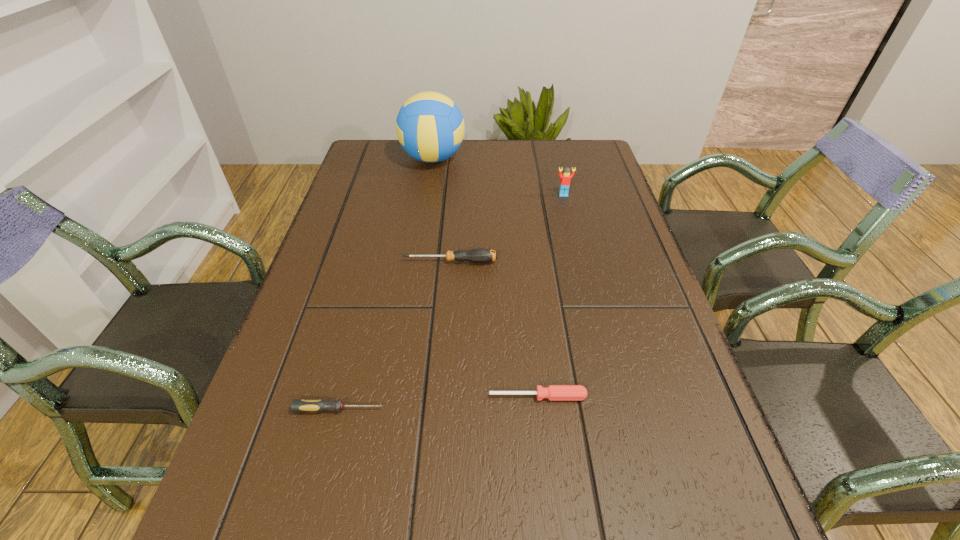
The image size is (960, 540). Identify the location of the farthest object. (430, 127).

Identify the location of the tallest object. (430, 127).

Where is `the rightmost object`? The image size is (960, 540). the rightmost object is located at coordinates (565, 177).

Locate an element on the screen. This screenshot has width=960, height=540. Lego is located at coordinates (565, 177).

The image size is (960, 540). What are the coordinates of `the third nearest object` in the screenshot? It's located at (480, 255).

Locate an element on the screen. the third shortest object is located at coordinates (480, 255).

Identify the location of the second nearest screwdriver. (553, 392).

At what (x,y) coordinates should I click in order to perform the action: click on the nearest screwdriver. Please return your answer as a coordinate pair (x, y). The width and height of the screenshot is (960, 540). Looking at the image, I should click on (298, 405).

The height and width of the screenshot is (540, 960). Identify the location of free space located 0.170m on the right of the farthest object. (517, 159).

In order to click on free space located 0.370m on the face of the fourth nearest object in this screenshot , I will do `click(586, 287)`.